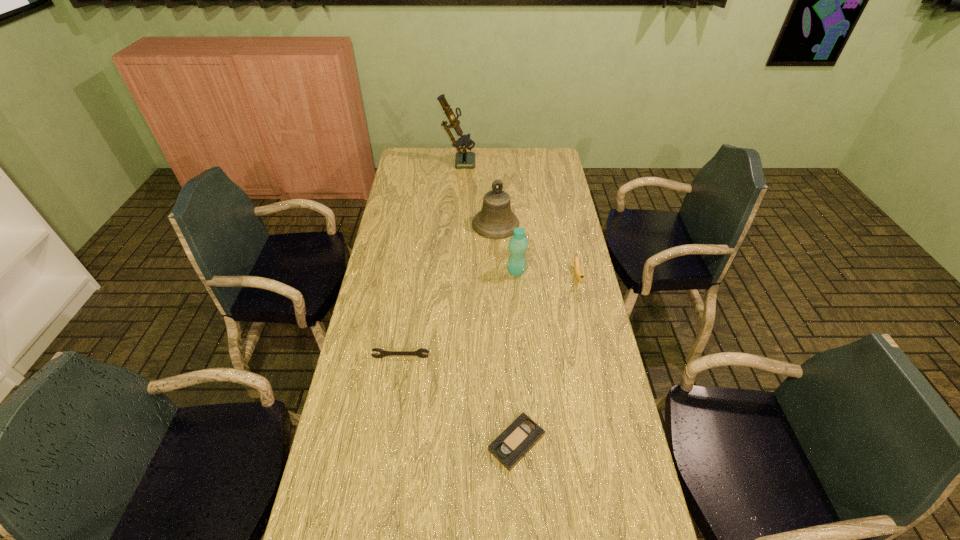
In order to click on vacant region at the left edge of the desktop in this screenshot , I will do `click(404, 173)`.

Image resolution: width=960 pixels, height=540 pixels. In order to click on vacant area at the right edge of the desktop in this screenshot , I will do `click(637, 523)`.

Locate an element on the screen. This screenshot has width=960, height=540. vacant space at the far left corner of the desktop is located at coordinates (401, 158).

In the image, there is a desktop. Where is `blank space at the far right corner`? Image resolution: width=960 pixels, height=540 pixels. blank space at the far right corner is located at coordinates (552, 153).

Where is `unoccupied position between the bottle and the rightmost object`? The width and height of the screenshot is (960, 540). unoccupied position between the bottle and the rightmost object is located at coordinates (546, 274).

At what (x,y) coordinates should I click in order to perform the action: click on free spot between the bottle and the bell. Please return your answer as a coordinate pair (x, y). The image size is (960, 540). Looking at the image, I should click on (506, 248).

You are a GUI agent. You are given a task and a screenshot of the screen. Output one action in this format:
    pyautogui.click(x=<x>, y=<y>)
    Task: Click on the empty space that is in between the banana and the videotape
    The height and width of the screenshot is (540, 960).
    Given the screenshot: What is the action you would take?
    pyautogui.click(x=547, y=360)

This screenshot has height=540, width=960. What are the coordinates of `free space between the second farthest object and the fourth tallest object` in the screenshot? It's located at (537, 250).

Where is `empty space that is in between the wrench and the fifth nearest object`? The height and width of the screenshot is (540, 960). empty space that is in between the wrench and the fifth nearest object is located at coordinates (448, 291).

Find the location of a particular element. vacant area that lies between the shortest object and the second shortest object is located at coordinates (459, 400).